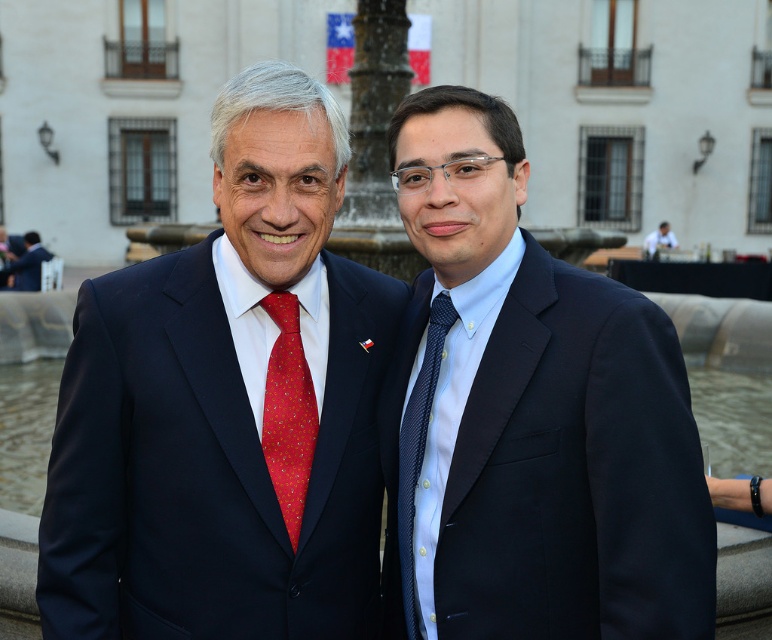
You are a photographer adjusting your camera to focus on two specific points in the scene. The first point is at coordinates point (271, 294) and the second is at point (647, 241). Which point should you focus on first if you want to capture the closest object to the camera?

Point (271, 294) is closer to the camera than point (647, 241), so you should focus on point (271, 294) first to capture the closest object.

What is located at the coordinates point (288, 412)?

The red silk tie at center is located at point (288, 412).

You are a photographer at a formal event. You need to capture a photo of the blue satin suit at center and the navy blue suit at center. Which of the two suits is narrower in width?

The blue satin suit at center has a lesser width compared to the navy blue suit at center, so the blue satin suit at center is narrower in width.